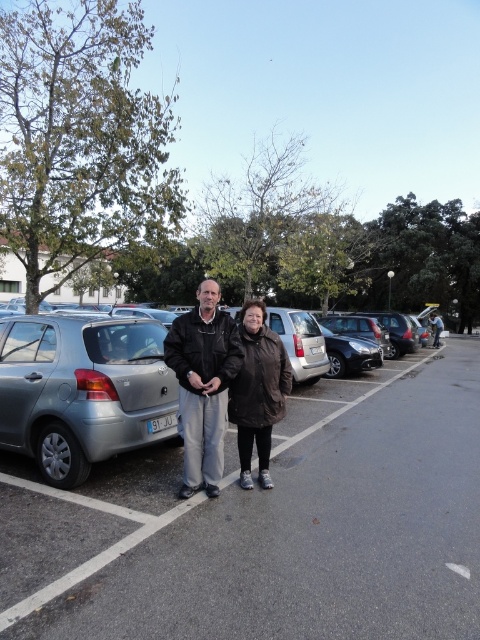
Question: Which object is the farthest from the dark brown leather jacket at center?

Choices:
 (A) silver metallic car at center
 (B) black leather jacket at center
 (C) silver metallic hatchback at center

Answer: (C)

Question: Does satin silver hatchback at left appear under black leather jacket at center?

Choices:
 (A) no
 (B) yes

Answer: (A)

Question: Which point is closer to the camera?

Choices:
 (A) dark brown leather jacket at center
 (B) silver metallic car at center
 (C) silver metallic hatchback at center

Answer: (B)

Question: Which point is closer to the camera taking this photo?

Choices:
 (A) (211, 467)
 (B) (242, 438)
 (C) (418, 387)
 (D) (360, 380)

Answer: (A)

Question: Can you confirm if silver metallic car at center is positioned to the right of satin silver hatchback at left?

Choices:
 (A) no
 (B) yes

Answer: (B)

Question: Can you confirm if satin silver hatchback at left is positioned above dark brown leather jacket at center?

Choices:
 (A) yes
 (B) no

Answer: (A)